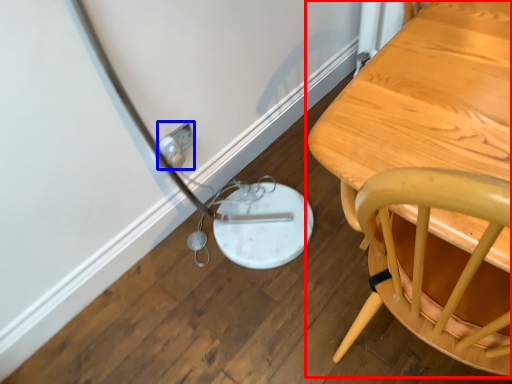
Question: Which point is further to the camera, table (highlighted by a red box) or electric outlet (highlighted by a blue box)?

Choices:
 (A) table
 (B) electric outlet

Answer: (B)